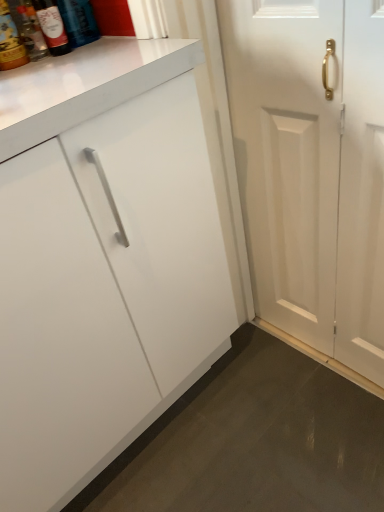
Question: From the image's perspective, is white wooden door at right located beneath matte glass bottle at upper left, which ranks as the 1th bottle in right-to-left order?

Choices:
 (A) yes
 (B) no

Answer: (A)

Question: Can you confirm if white wooden door at right is thinner than matte glass bottle at upper left, which ranks as the 1th bottle in right-to-left order?

Choices:
 (A) no
 (B) yes

Answer: (B)

Question: Is white wooden door at right located outside matte glass bottle at upper left, which ranks as the 4th bottle in left-to-right order?

Choices:
 (A) yes
 (B) no

Answer: (A)

Question: Is white wooden door at right with matte glass bottle at upper left, which ranks as the 4th bottle in left-to-right order?

Choices:
 (A) yes
 (B) no

Answer: (B)

Question: From the image's perspective, is white wooden door at right located above matte glass bottle at upper left, which ranks as the 1th bottle in right-to-left order?

Choices:
 (A) no
 (B) yes

Answer: (A)

Question: Considering the positions of matte glass bottle at upper left, arranged as the 2th bottle when viewed from the left, and matte glass bottle at upper left, which ranks as the 1th bottle in right-to-left order, in the image, is matte glass bottle at upper left, arranged as the 2th bottle when viewed from the left, wider or thinner than matte glass bottle at upper left, which ranks as the 1th bottle in right-to-left order,?

Choices:
 (A) thin
 (B) wide

Answer: (A)

Question: From a real-world perspective, is matte glass bottle at upper left, the 3th bottle positioned from the right, positioned above or below matte glass bottle at upper left, which ranks as the 1th bottle in right-to-left order?

Choices:
 (A) above
 (B) below

Answer: (B)

Question: From their relative heights in the image, would you say matte glass bottle at upper left, the 3th bottle positioned from the right, is taller or shorter than matte glass bottle at upper left, which ranks as the 4th bottle in left-to-right order?

Choices:
 (A) tall
 (B) short

Answer: (B)

Question: Relative to matte glass bottle at upper left, which ranks as the 4th bottle in left-to-right order, is matte glass bottle at upper left, arranged as the 2th bottle when viewed from the left, in front or behind?

Choices:
 (A) behind
 (B) front

Answer: (A)

Question: Considering the positions of white wooden door at right and matte glass bottle at upper left, which appears as the second bottle when viewed from the right, in the image, is white wooden door at right wider or thinner than matte glass bottle at upper left, which appears as the second bottle when viewed from the right,?

Choices:
 (A) thin
 (B) wide

Answer: (B)

Question: Which is correct: white wooden door at right is inside matte glass bottle at upper left, which is the third bottle from left to right, or outside of it?

Choices:
 (A) outside
 (B) inside

Answer: (A)

Question: From the image's perspective, relative to matte glass bottle at upper left, which appears as the second bottle when viewed from the right, is white wooden door at right above or below?

Choices:
 (A) above
 (B) below

Answer: (B)

Question: In terms of height, does white wooden door at right look taller or shorter compared to matte glass bottle at upper left, which is the third bottle from left to right?

Choices:
 (A) tall
 (B) short

Answer: (A)

Question: From the image's perspective, is matte glass bottle at upper left, arranged as the 2th bottle when viewed from the left, located above or below white wooden door at right?

Choices:
 (A) above
 (B) below

Answer: (A)

Question: From a real-world perspective, relative to white wooden door at right, is matte glass bottle at upper left, arranged as the 2th bottle when viewed from the left, vertically above or below?

Choices:
 (A) above
 (B) below

Answer: (A)